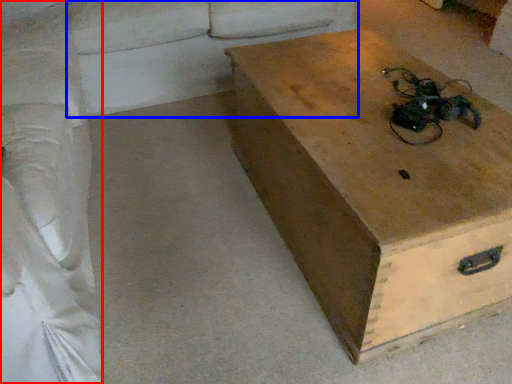
Question: Which of the following is the closest to the observer, couch (highlighted by a red box) or couch (highlighted by a blue box)?

Choices:
 (A) couch
 (B) couch

Answer: (A)